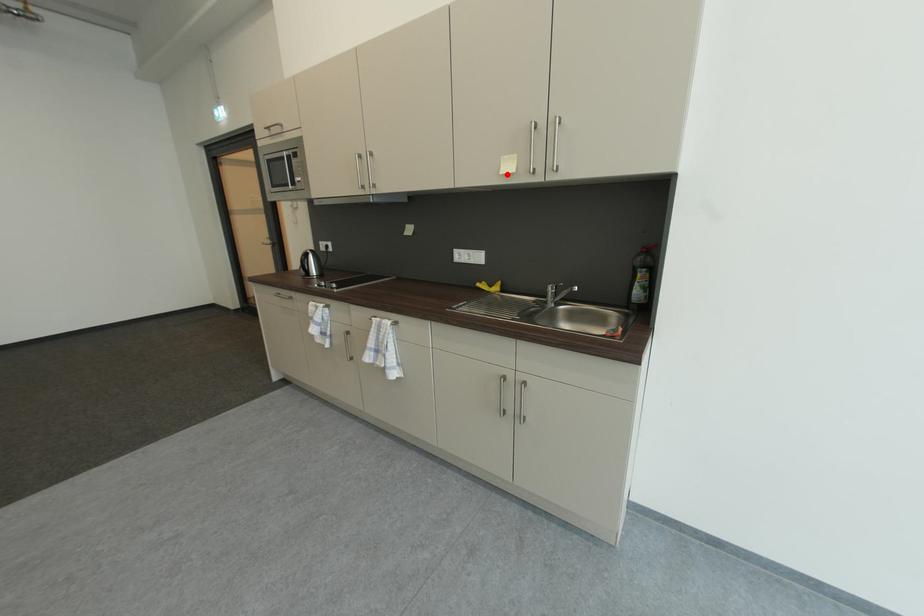
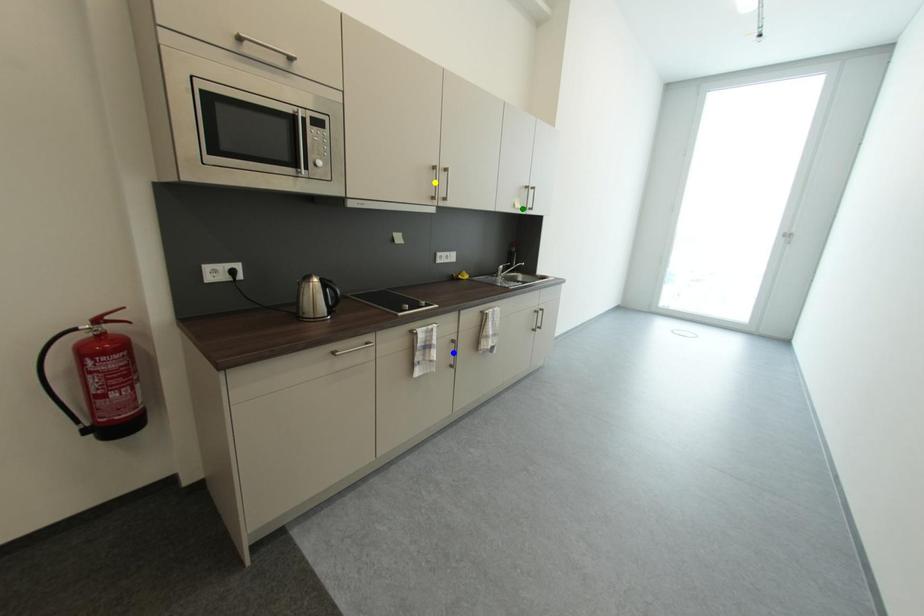
Question: I am providing you with two images of the same scene from different viewpoints. A red point is marked on the first image. You are given multiple points on the second image. Which mark in image 2 goes with the point in image 1?

Choices:
 (A) green point
 (B) yellow point
 (C) blue point

Answer: (A)